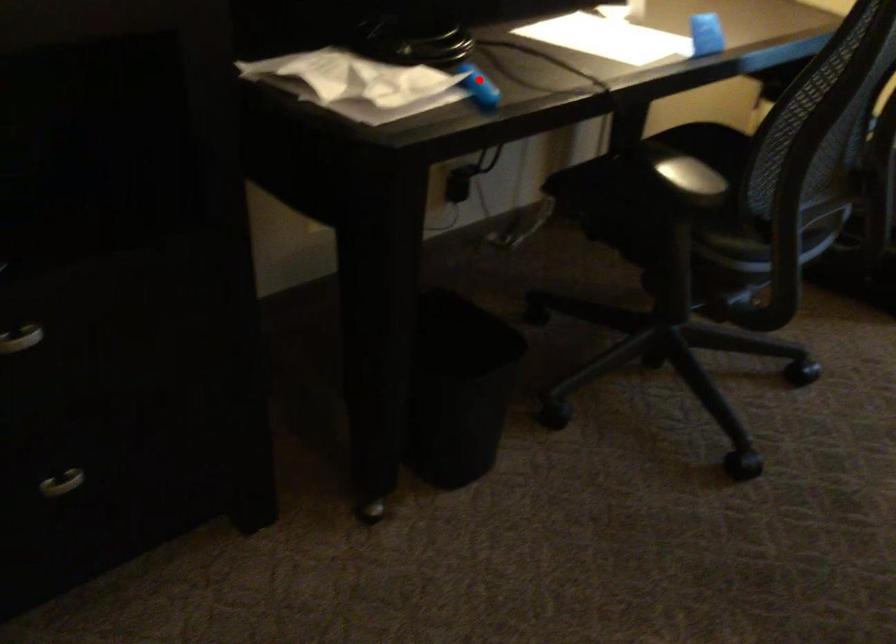
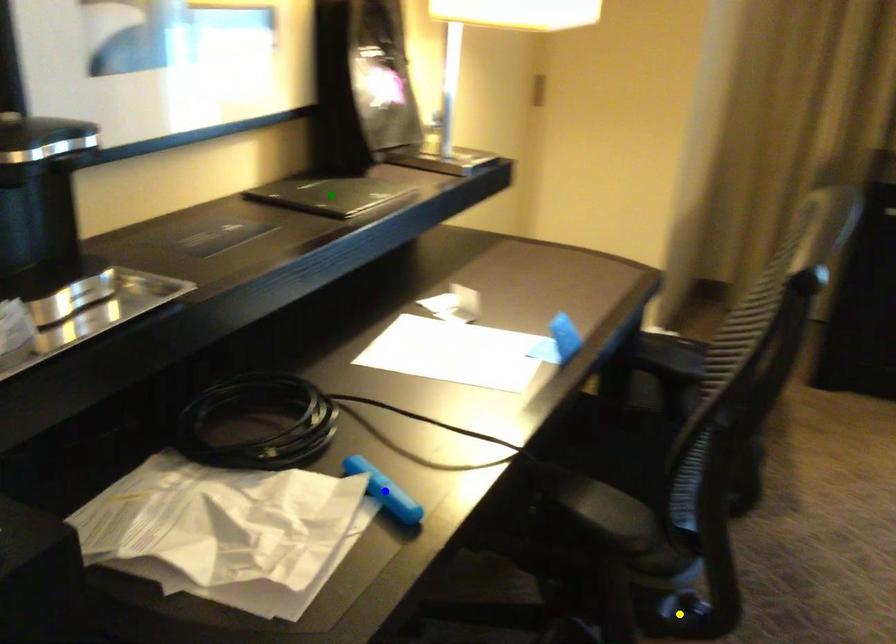
Question: I am providing you with two images of the same scene from different viewpoints. A red point is marked on the first image. You are given multiple points on the second image. Can you choose the point in image 2 that corresponds to the point in image 1?

Choices:
 (A) yellow point
 (B) blue point
 (C) green point

Answer: (B)